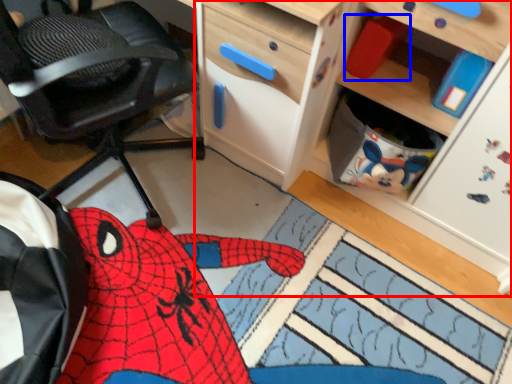
Question: Among these objects, which one is nearest to the camera, cabinetry (highlighted by a red box) or toy (highlighted by a blue box)?

Choices:
 (A) cabinetry
 (B) toy

Answer: (A)